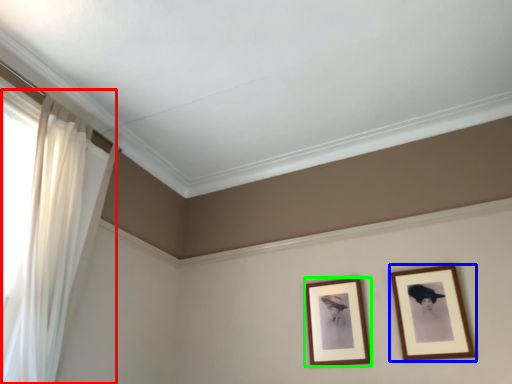
Question: Which is nearer to the curtain (highlighted by a red box)? picture frame (highlighted by a blue box) or picture frame (highlighted by a green box).

Choices:
 (A) picture frame
 (B) picture frame

Answer: (B)